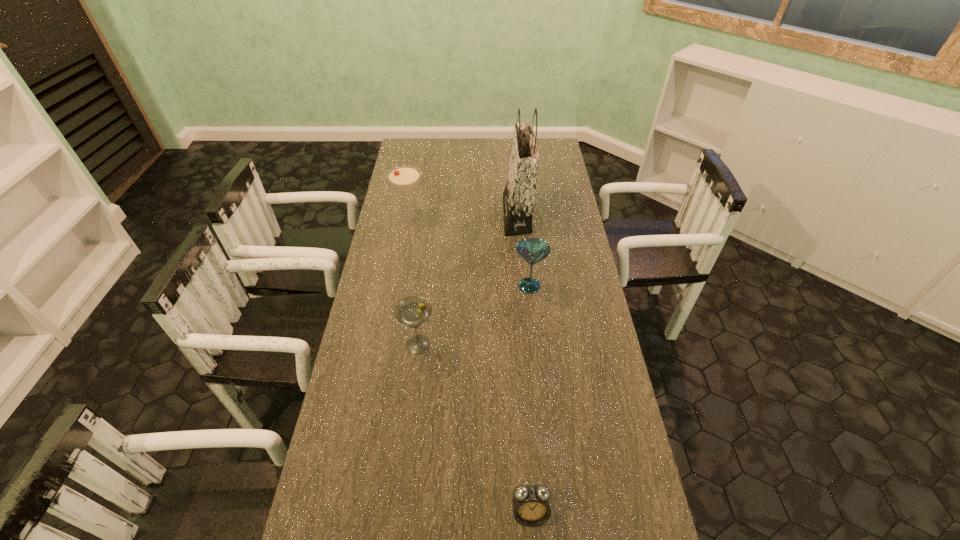
The width and height of the screenshot is (960, 540). What are the coordinates of `empty space between the shortest object and the farthest martini` in the screenshot? It's located at click(469, 365).

Locate an element on the screen. The height and width of the screenshot is (540, 960). vacant area that lies between the nearest object and the second nearest object is located at coordinates (474, 429).

Locate an element on the screen. This screenshot has height=540, width=960. vacant point located between the rightmost martini and the fourth farthest object is located at coordinates (474, 315).

Identify the location of free point between the farthest martini and the shopping bag. (464, 217).

Image resolution: width=960 pixels, height=540 pixels. I want to click on vacant region between the farthest martini and the shopping bag, so click(x=464, y=217).

Locate an element on the screen. The width and height of the screenshot is (960, 540). free point between the farthest martini and the alarm clock is located at coordinates (469, 365).

Locate which object is the closest to the nearest martini. Please provide its 2D coordinates. Your answer should be formatted as a tuple, i.e. [(x, y)], where the tuple contains the x and y coordinates of a point satisfying the conditions above.

[(533, 250)]

The width and height of the screenshot is (960, 540). What are the coordinates of `object that is the third closest to the nearest object` in the screenshot? It's located at (519, 194).

Point out which martini is positioned as the second nearest to the farthest martini. Please provide its 2D coordinates. Your answer should be formatted as a tuple, i.e. [(x, y)], where the tuple contains the x and y coordinates of a point satisfying the conditions above.

[(412, 311)]

Point out which martini is positioned as the second nearest to the rightmost martini. Please provide its 2D coordinates. Your answer should be formatted as a tuple, i.e. [(x, y)], where the tuple contains the x and y coordinates of a point satisfying the conditions above.

[(404, 177)]